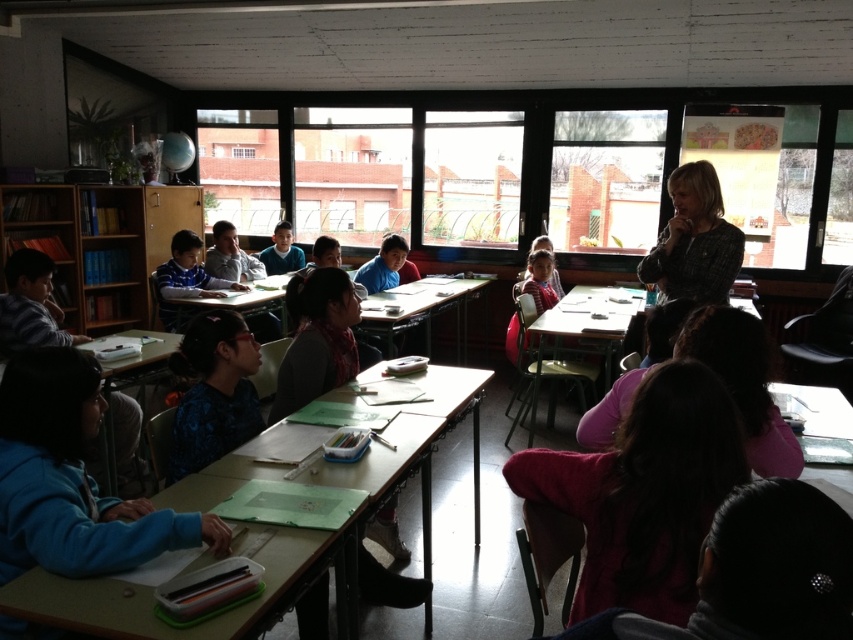
You are standing in the classroom and want to take a photo of the point at coordinates point (x=132, y=621). If your camera has a maximum focus range of 4 feet, will it be able to focus on that point?

The point (x=132, y=621) is 4.17 feet from the camera, which is slightly beyond the camera maximum focus range of 4 feet. Therefore, the camera will not be able to focus on the point.

You are a student entering the classroom and need to find your desk. You see the wooden desk at lower left and the wooden bookshelf at left. Which object should you walk around to reach your desk if it is located behind the bookshelf?

You should walk around the wooden bookshelf at left to reach your desk because the wooden desk at lower left is positioned on the right side of the wooden bookshelf at left, meaning the desk is to the right of the bookshelf. Therefore, going around the bookshelf on its right side would lead you to the desk.

You are standing at the entrance of the classroom and want to reach the wooden desk at lower left. Which direction should you move in to get there?

The wooden desk at lower left is located at point 0.833 on the x axis and 0.341 on the y axis. Since you are at the entrance, you should move towards the lower left direction to reach the wooden desk at lower left.